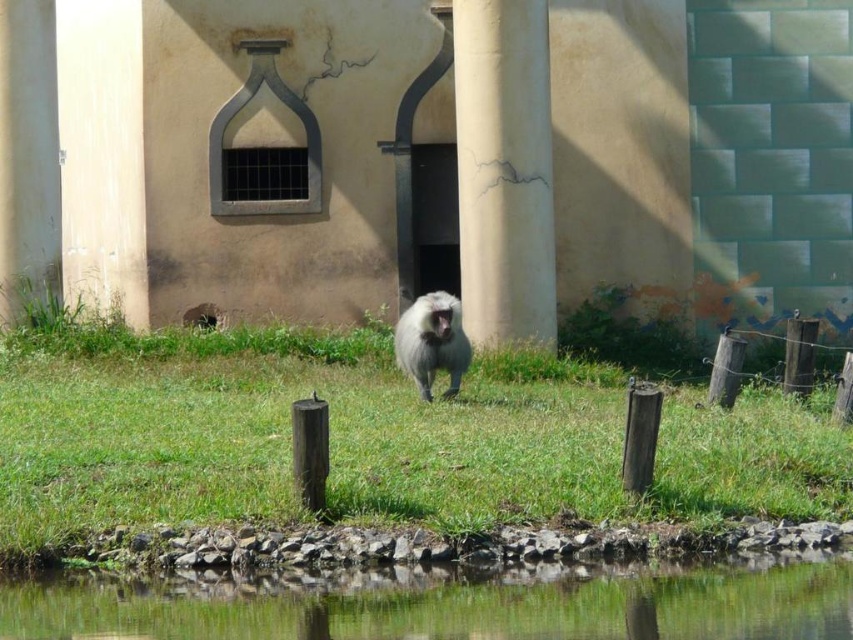
Based on the photo, based on the scene description, if you were standing on the green grass at center, which direction would the clear water at lower center be relative to you?

The clear water at lower center is behind the green grass at center, so if you are standing on the green grass at center, the clear water at lower center would be behind you.

You are a photographer trying to capture the fuzzy gray monkey at center. You notice a smooth concrete pillar at center in the background. Will the pillar block your view of the monkey?

The smooth concrete pillar at center is above the fuzzy gray monkey at center, so it will not block the view of the monkey since it is positioned higher up.

You are a gardener trying to plant a new tree. You have two options for locations in the image. The first is the green grass at center and the second is the smooth concrete pillar at center. Which location would be more suitable for planting the tree?

The green grass at center has a larger size compared to the smooth concrete pillar at center, making it more suitable for planting a tree since it provides enough space and soil for the tree to grow.